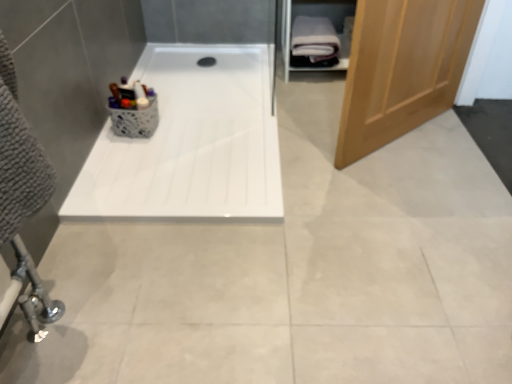
Question: From a real-world perspective, is white glossy bathtub at center physically located above or below light brown wooden door at right?

Choices:
 (A) below
 (B) above

Answer: (A)

Question: Looking at the image, does white glossy bathtub at center seem bigger or smaller compared to light brown wooden door at right?

Choices:
 (A) small
 (B) big

Answer: (A)

Question: Which is nearer to the white soft towel at upper right?

Choices:
 (A) light brown wooden door at right
 (B) white glossy bathtub at center

Answer: (B)

Question: Estimate the real-world distances between objects in this image. Which object is closer to the white soft towel at upper right?

Choices:
 (A) light brown wooden door at right
 (B) white glossy bathtub at center

Answer: (B)